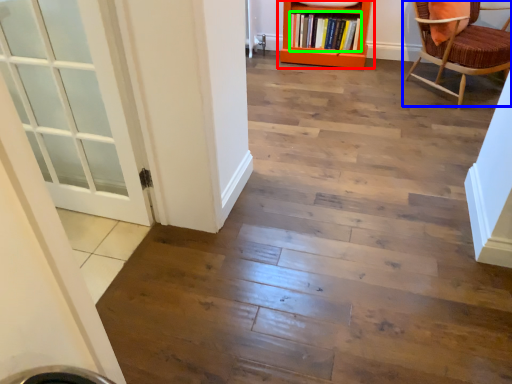
Question: Which object is positioned farthest from bookcase (highlighted by a red box)? Select from chair (highlighted by a blue box) and book (highlighted by a green box).

Choices:
 (A) chair
 (B) book

Answer: (A)